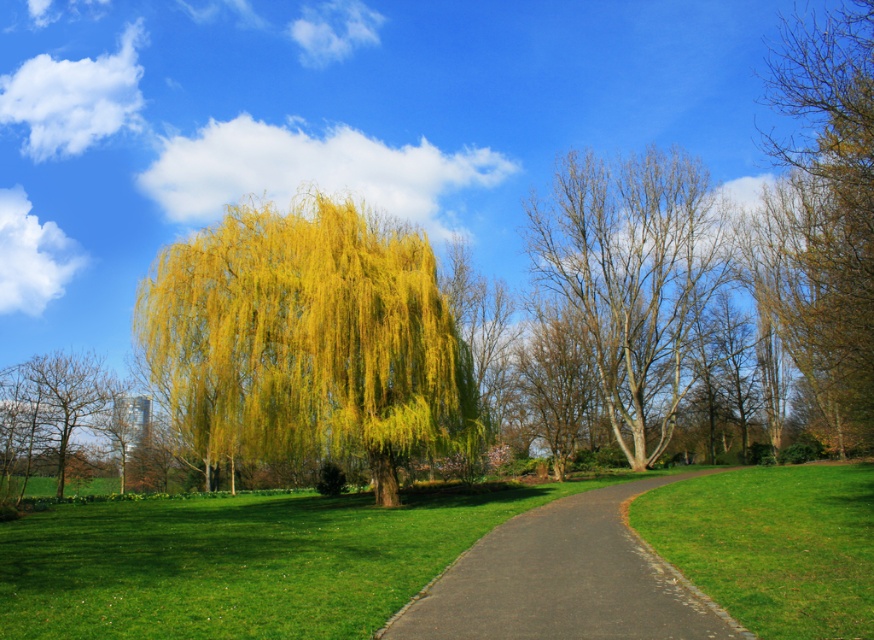
You are standing at the point closer to the camera in the park scene. Which point are you at, point (529, 220) or point (507, 627)?

You are at point (529, 220) because it is further to the camera than point (507, 627).

You are standing at the entrance of the park and want to reach the bare wood tree at center. According to the coordinates provided, what are the exact coordinates where you should head to locate the tree?

The exact coordinates to locate the bare wood tree at center are at point (633, 278).